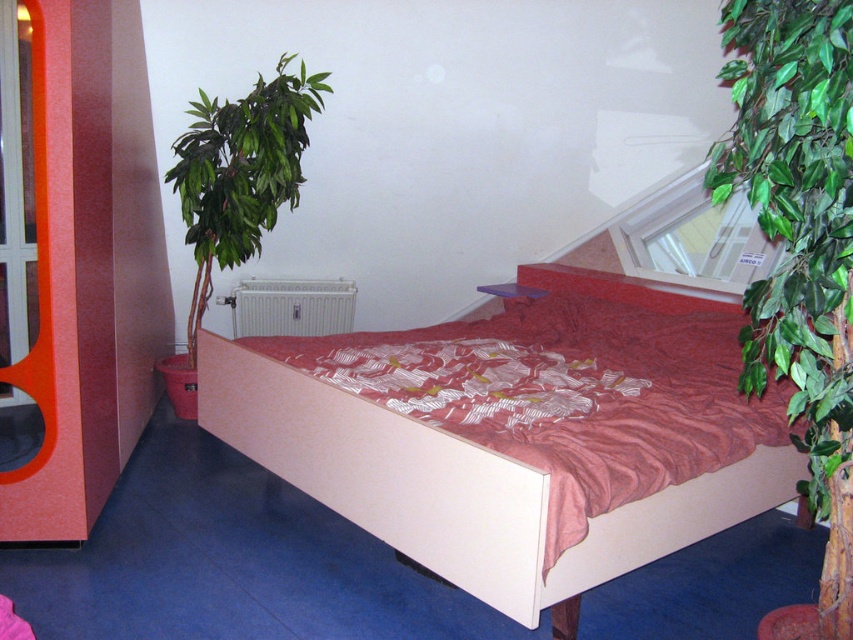
Consider the image. Is green leafy plant at left thinner than white metallic radiator at center?

No, green leafy plant at left is not thinner than white metallic radiator at center.

Does green leafy plant at left appear on the right side of white metallic radiator at center?

Incorrect, green leafy plant at left is not on the right side of white metallic radiator at center.

Is point (293, 77) behind point (352, 289)?

No.

This screenshot has width=853, height=640. What are the coordinates of `green leafy plant at left` in the screenshot? It's located at (241, 172).

Does green leafy plant at right come behind white metallic radiator at center?

No, green leafy plant at right is closer to the viewer.

Can you confirm if green leafy plant at right is thinner than white metallic radiator at center?

Indeed, green leafy plant at right has a lesser width compared to white metallic radiator at center.

Is point (842, 364) less distant than point (312, 291)?

Yes, it is.

This screenshot has height=640, width=853. Identify the location of green leafy plant at right. (795, 209).

Between matte white bed at center and green leafy plant at right, which one has less height?

Standing shorter between the two is matte white bed at center.

Does matte white bed at center appear on the right side of green leafy plant at right?

Incorrect, matte white bed at center is not on the right side of green leafy plant at right.

Is point (672, 524) closer to camera compared to point (822, 212)?

No, it is behind (822, 212).

The height and width of the screenshot is (640, 853). What are the coordinates of `matte white bed at center` in the screenshot? It's located at (460, 486).